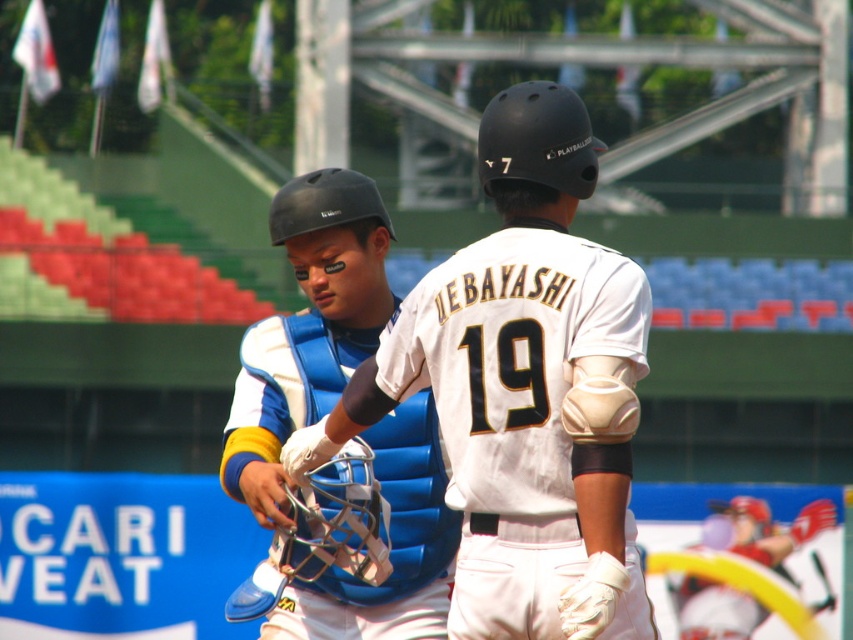
You are a baseball player standing at home plate. You see the blue padded chest protector at center represented by point (306,330). In which direction should you move to reach it?

The blue padded chest protector at center is located at point (306,330), so you should move towards the center of the field to reach it.

You are a baseball coach analyzing the game. You notice a point marked at coordinates (524, 388). Which object is this point located on?

The point marked at coordinates (524, 388) is located on the white matte baseball glove at center.

You are a spectator at the baseball game and want to take a photo of both the white matte baseball glove at center and the blue padded chest protector at center. Which one will appear larger in your photo?

The white matte baseball glove at center will appear larger in the photo because it is closer to the viewer than the blue padded chest protector at center.